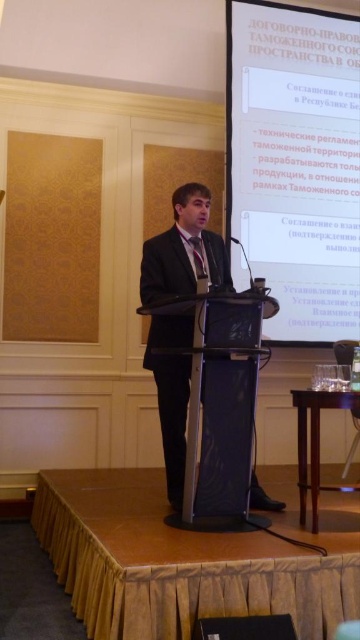
Question: Can you confirm if white glossy projection screen at upper center is positioned to the left of black suit at center?

Choices:
 (A) no
 (B) yes

Answer: (A)

Question: Which of the following is the closest to the observer?

Choices:
 (A) white glossy projection screen at upper center
 (B) black suit at center

Answer: (B)

Question: Is white glossy projection screen at upper center wider than black suit at center?

Choices:
 (A) yes
 (B) no

Answer: (A)

Question: Which object appears closest to the camera in this image?

Choices:
 (A) black suit at center
 (B) white glossy projection screen at upper center

Answer: (A)

Question: Is white glossy projection screen at upper center to the right of black suit at center from the viewer's perspective?

Choices:
 (A) yes
 (B) no

Answer: (A)